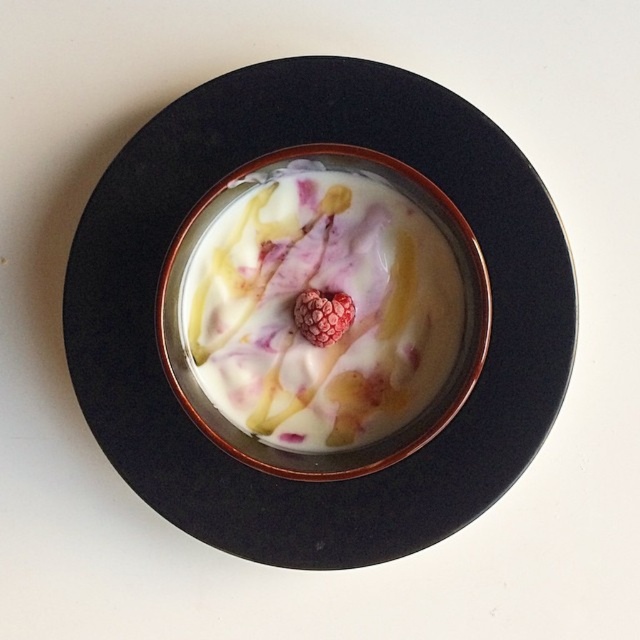
Question: Is black ceramic bowl at center smaller than raspberry at center?

Choices:
 (A) yes
 (B) no

Answer: (B)

Question: Is black ceramic bowl at center below white creamy yogurt at center?

Choices:
 (A) yes
 (B) no

Answer: (B)

Question: Where is black ceramic bowl at center located in relation to white creamy yogurt at center in the image?

Choices:
 (A) below
 (B) above

Answer: (B)

Question: Which point is closer to the camera?

Choices:
 (A) (308, 316)
 (B) (202, 451)
 (C) (328, 387)

Answer: (A)

Question: Which of the following is the closest to the observer?

Choices:
 (A) (515, 349)
 (B) (260, 364)
 (C) (308, 301)

Answer: (C)

Question: Estimate the real-world distances between objects in this image. Which object is closer to the black ceramic bowl at center?

Choices:
 (A) raspberry at center
 (B) white creamy yogurt at center

Answer: (B)